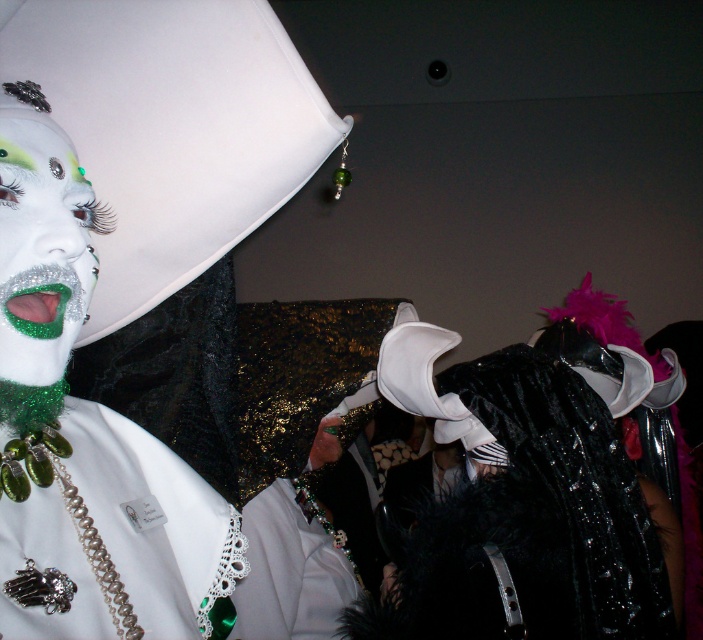
Is shiny black cape at center smaller than glittery green lips at center?

No.

Does point (631, 355) come farther from viewer compared to point (44, 250)?

Yes, point (631, 355) is farther from viewer.

Locate an element on the screen. Image resolution: width=703 pixels, height=640 pixels. shiny black cape at center is located at coordinates click(527, 496).

Who is taller, shiny black cape at center or white lace collar at center?

shiny black cape at center

Who is more forward, (606, 429) or (309, 566)?

Point (606, 429) is more forward.

Where is `shiny black cape at center`? The image size is (703, 640). shiny black cape at center is located at coordinates (527, 496).

Does glittery green lips at center appear under silver/glass beads necklace at lower left?

Actually, glittery green lips at center is above silver/glass beads necklace at lower left.

Is glittery green lips at center above silver/glass beads necklace at lower left?

Yes, glittery green lips at center is above silver/glass beads necklace at lower left.

The width and height of the screenshot is (703, 640). I want to click on glittery green lips at center, so click(41, 250).